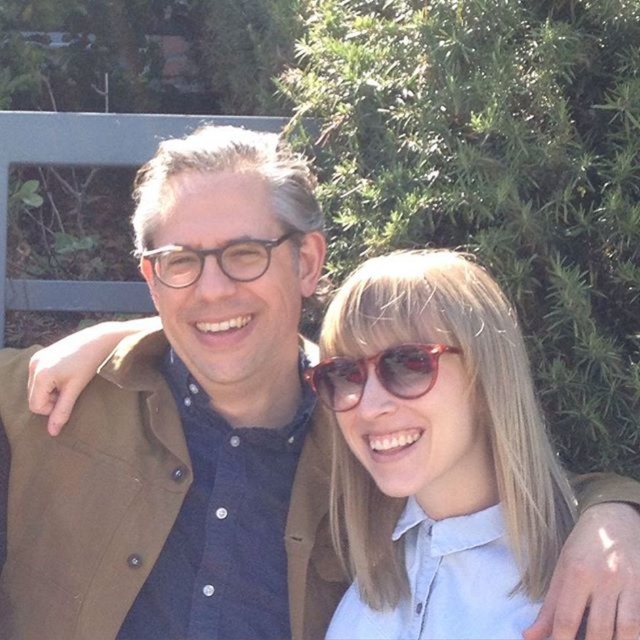
You are taking a photo of two people standing in front of a green background. You notice two points in the image at coordinates point (388, 525) and point (380, 358). Which point is closer to the camera?

Point (388, 525) is further to the camera than point (380, 358), so the point closer to the camera is point (380, 358).

You are a photographer trying to capture a closeup shot of both the translucent red sunglasses at center and the matte black glasses at center. Since the camera can only focus on one object at a time, which object should you choose to ensure the other is still somewhat in focus due to their size difference?

The translucent red sunglasses at center is smaller than the matte black glasses at center. To keep both somewhat in focus, you should focus on the larger matte black glasses at center because depth of field is greater when focusing on larger objects, making the smaller one more likely to stay in focus.